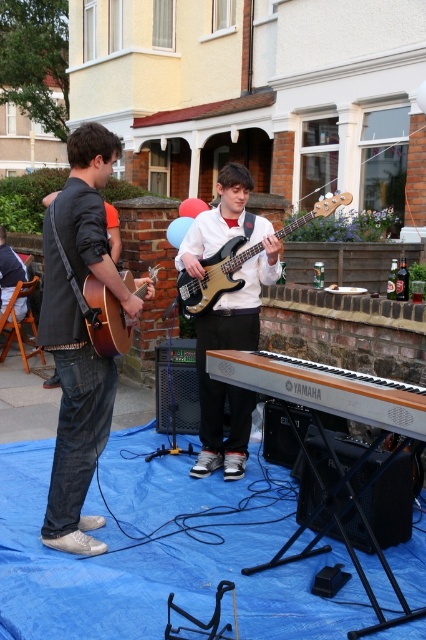
Question: Observing the image, what is the correct spatial positioning of denim jeans at left in reference to shiny black bass guitar at center?

Choices:
 (A) left
 (B) right

Answer: (A)

Question: Which object is closer to the camera taking this photo?

Choices:
 (A) denim jeans at left
 (B) black glossy bass guitar at center
 (C) matte brown acoustic guitar at left
 (D) shiny black bass guitar at center

Answer: (A)

Question: Which point appears closest to the camera in this image?

Choices:
 (A) (111, 284)
 (B) (339, 204)
 (C) (101, 317)
 (D) (210, 458)

Answer: (A)

Question: Is shiny black bass guitar at center to the left of matte brown acoustic guitar at left from the viewer's perspective?

Choices:
 (A) no
 (B) yes

Answer: (A)

Question: Does denim jeans at left appear under black glossy bass guitar at center?

Choices:
 (A) no
 (B) yes

Answer: (B)

Question: Which of the following is the closest to the observer?

Choices:
 (A) (42, 330)
 (B) (238, 328)
 (C) (262, 243)

Answer: (A)